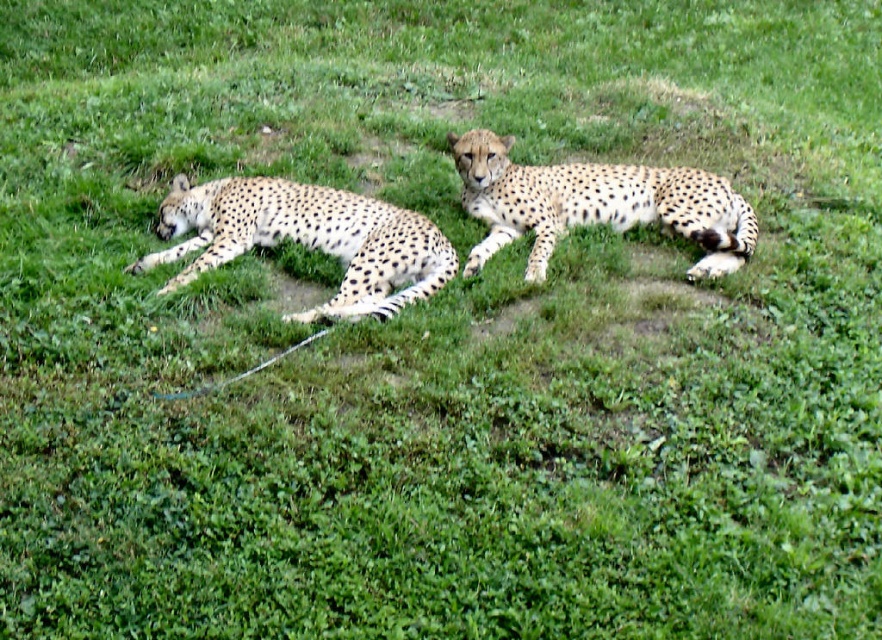
Which is in front, point (162, 260) or point (549, 241)?

Point (162, 260) is in front.

Can you confirm if spotted fur cheetah at left is thinner than spotted fur cheetah at center?

Correct, spotted fur cheetah at left's width is less than spotted fur cheetah at center's.

Which is behind, point (385, 259) or point (465, 266)?

Positioned behind is point (465, 266).

Locate an element on the screen. spotted fur cheetah at left is located at coordinates (305, 240).